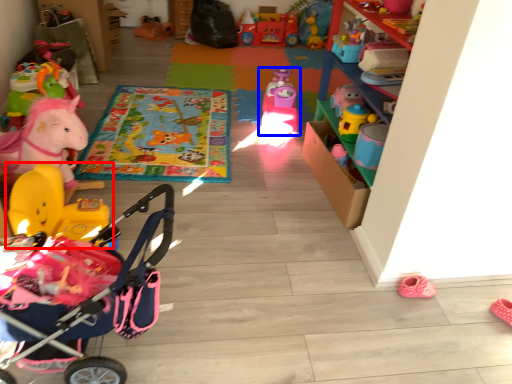
Question: Which point is closer to the camera, toy (highlighted by a red box) or toy (highlighted by a blue box)?

Choices:
 (A) toy
 (B) toy

Answer: (A)